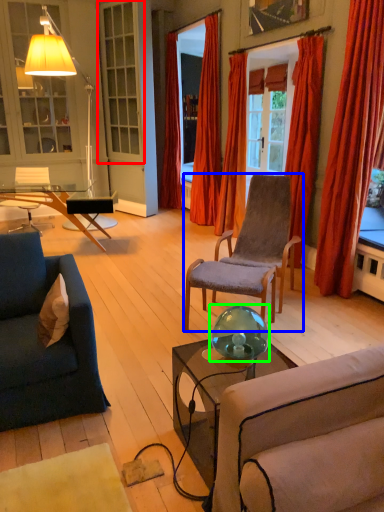
Question: Estimate the real-world distances between objects in this image. Which object is closer to window (highlighted by a red box), chair (highlighted by a blue box) or teal (highlighted by a green box)?

Choices:
 (A) chair
 (B) teal

Answer: (A)